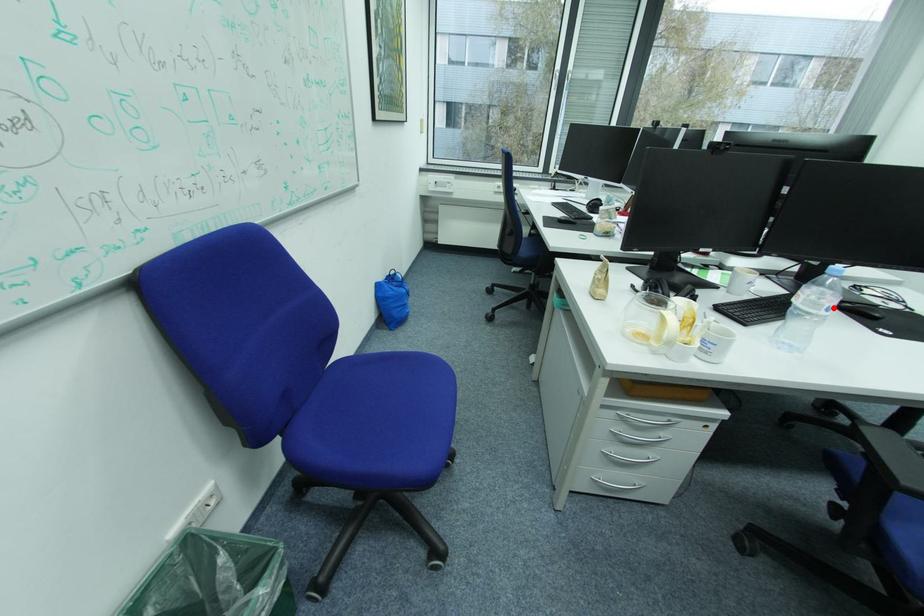
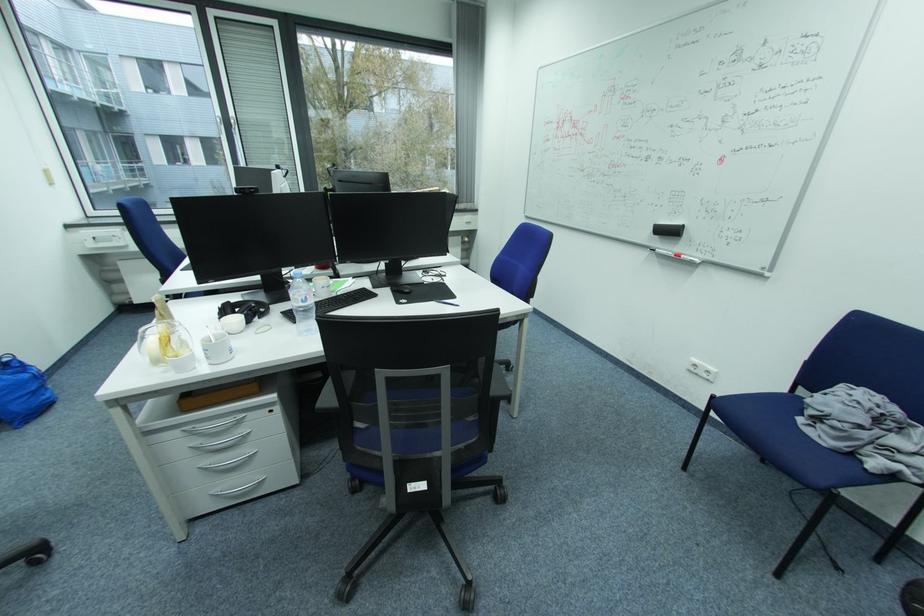
Locate, in the second image, the point that corresponds to the highlighted location in the first image.

(310, 301)